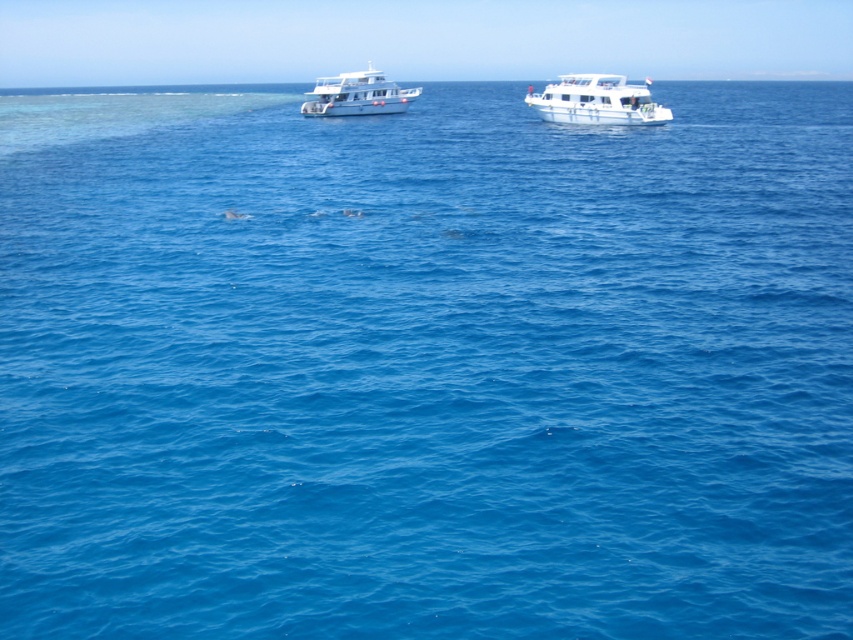
You are navigating a small drone that needs to fly from the white glossy boat at upper right to a destination point at coordinates 0.2, 0.7. Will the drone have to adjust its path to avoid the other boat in the scene?

The white glossy boat at upper right is located at point (596, 100), so the destination point at (596, 128) is very close to it. The drone may need to adjust its path slightly to avoid the other boat, depending on the exact position and size of the other vessel not specified in the objects description.

You are a photographer planning to capture both the white glossy boat at upper right and the white glossy boat at upper center in a single shot. Considering their heights, which boat should you focus on to ensure both are fully visible in the frame?

You should focus on the white glossy boat at upper center because it is taller than the white glossy boat at upper right, ensuring both are fully visible in the frame.